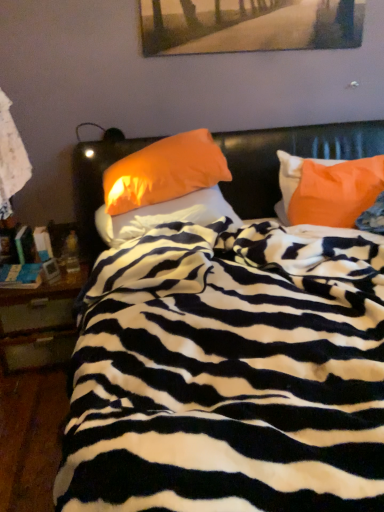
Question: Based on their sizes in the image, would you say orange fabric pillow at upper right, the first pillow from the right, is bigger or smaller than wooden painting at upper center?

Choices:
 (A) small
 (B) big

Answer: (B)

Question: From a real-world perspective, is orange fabric pillow at upper right, which appears as the third pillow when viewed from the left, above or below wooden painting at upper center?

Choices:
 (A) below
 (B) above

Answer: (A)

Question: Considering the real-world distances, which object is closest to the wooden painting at upper center?

Choices:
 (A) orange fabric pillow at center, the 2th pillow in the right-to-left sequence
 (B) orange fabric pillow at upper right, the first pillow from the right
 (C) zebra-patterned blanket at center
 (D) wooden nightstand at left
 (E) orange fabric pillow at center, the 1th pillow when ordered from left to right

Answer: (A)

Question: Which is farther from the wooden nightstand at left?

Choices:
 (A) orange fabric pillow at center, the 2th pillow in the right-to-left sequence
 (B) wooden painting at upper center
 (C) orange fabric pillow at upper right, which appears as the third pillow when viewed from the left
 (D) orange fabric pillow at center, the 1th pillow when ordered from left to right
 (E) zebra-patterned blanket at center

Answer: (B)